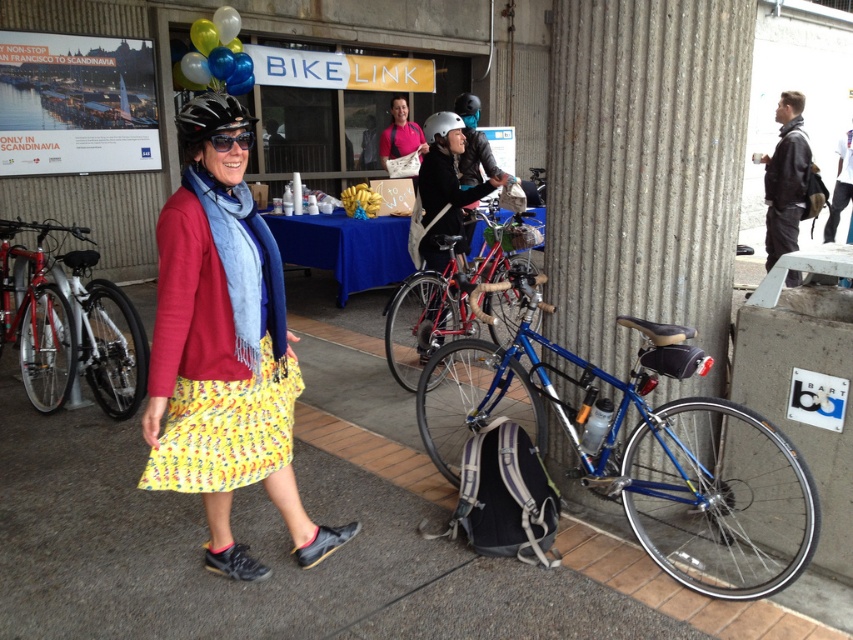
You are a photographer at the event and want to take a photo that includes both the shiny metallic balloons at upper left and the matte black sunglasses at center. From the photographer perspective, which object should be placed on the left side of the photo?

The shiny metallic balloons at upper left should be placed on the left side of the photo because it is to the left of the matte black sunglasses at center.

You are at the BIKE LINK event and want to find the shiny metallic balloons at upper left. Where should you look relative to the matte black sunglasses at center?

The shiny metallic balloons at upper left are located above the matte black sunglasses at center.